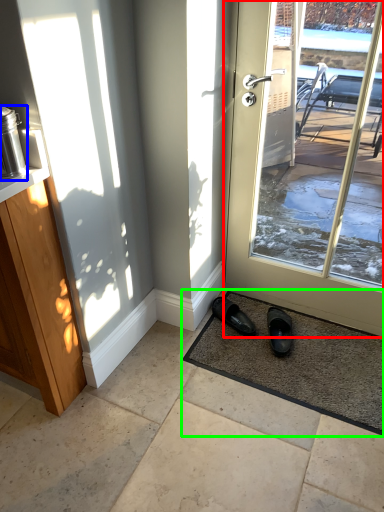
Question: Which object is positioned farthest from door (highlighted by a red box)? Select from appliance (highlighted by a blue box) and mat (highlighted by a green box).

Choices:
 (A) appliance
 (B) mat

Answer: (A)